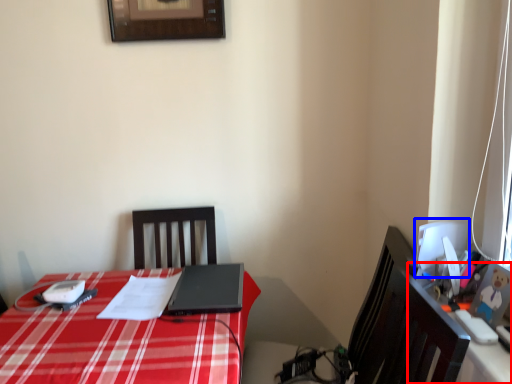
Question: Which point is closer to the camera, computer desk (highlighted by a red box) or computer monitor (highlighted by a blue box)?

Choices:
 (A) computer desk
 (B) computer monitor

Answer: (A)